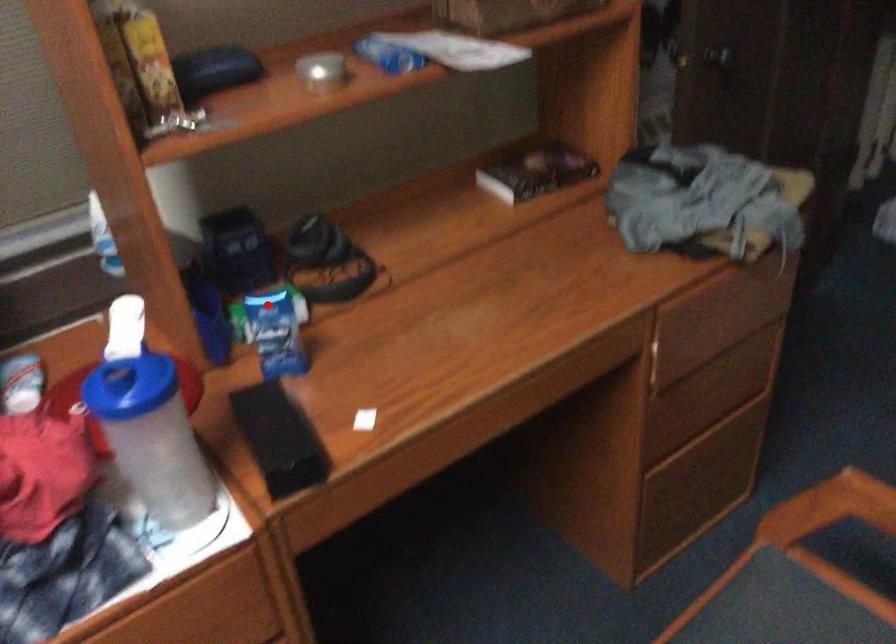
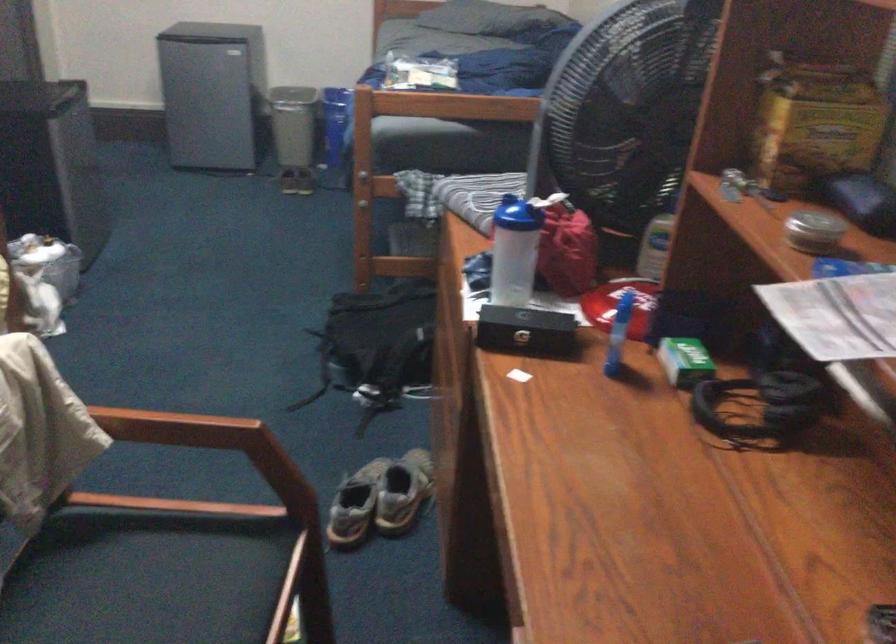
Question: A red point is marked in image1. In image2, is the corresponding 3D point closer to the camera or farther? Reply with the corresponding letter.

Choices:
 (A) The corresponding 3D point is closer.
 (B) The corresponding 3D point is farther.

Answer: (B)